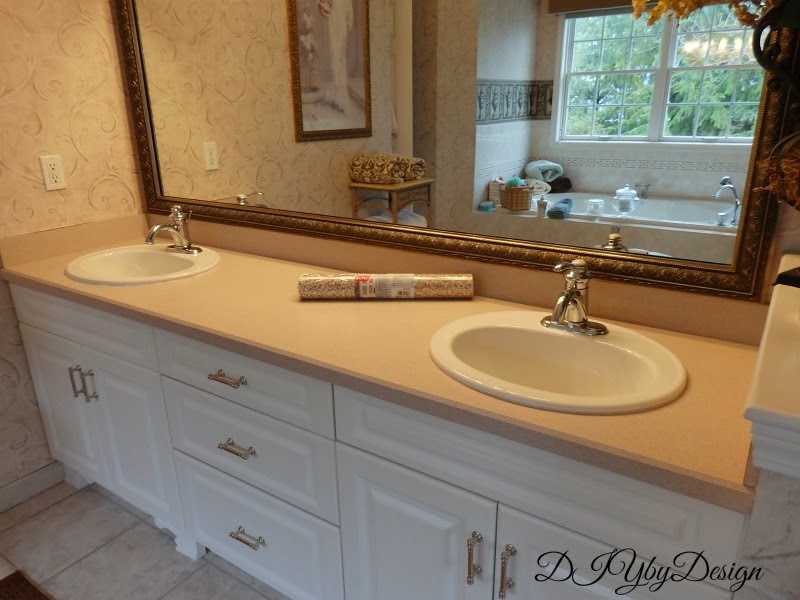
Identify the location of faucets. This screenshot has height=600, width=800. (569, 312), (177, 233).